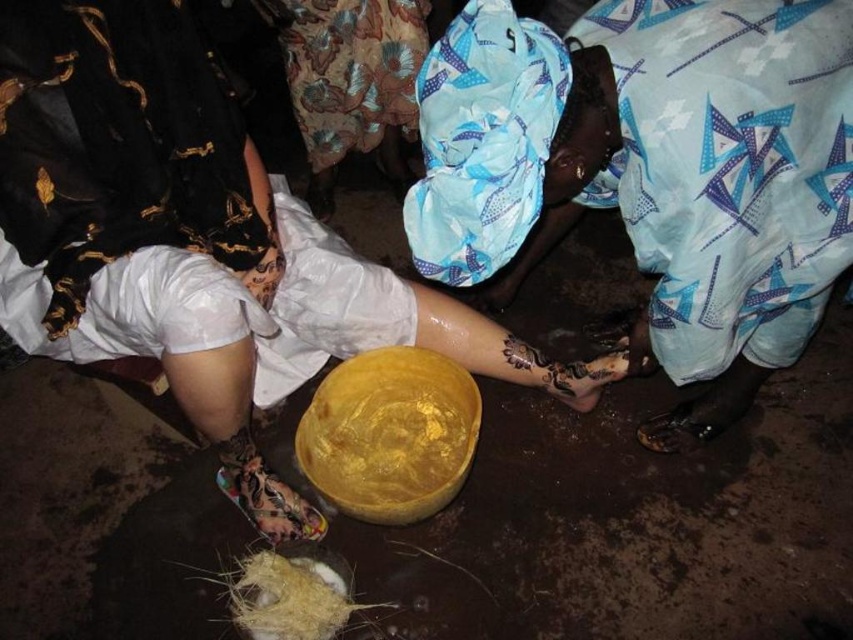
You are an artist trying to choose between the golden matte bowl at center and the blue printed fabric at upper center for a project. Which object is thinner?

The golden matte bowl at center is thinner than the blue printed fabric at upper center according to the description.

You are an artist planning to place a small sculpture between the golden matte bowl at center and the blue printed fabric at upper center. Based on the scene description, which object should the sculpture be closer to if you want it to align with the existing arrangement?

The golden matte bowl at center is positioned on the right side of blue printed fabric at upper center, so placing the sculpture closer to the golden matte bowl at center would maintain alignment with the existing arrangement.

You are a photographer standing in the scene and want to take a closeup photo of the golden matte bowl at center without the straw nest at lower center appearing in the frame. Is this possible?

The golden matte bowl at center is closer to the viewer than the straw nest at lower center, so yes, you can take a closeup photo of the golden matte bowl at center without the straw nest at lower center appearing in the frame by focusing on the closer object.